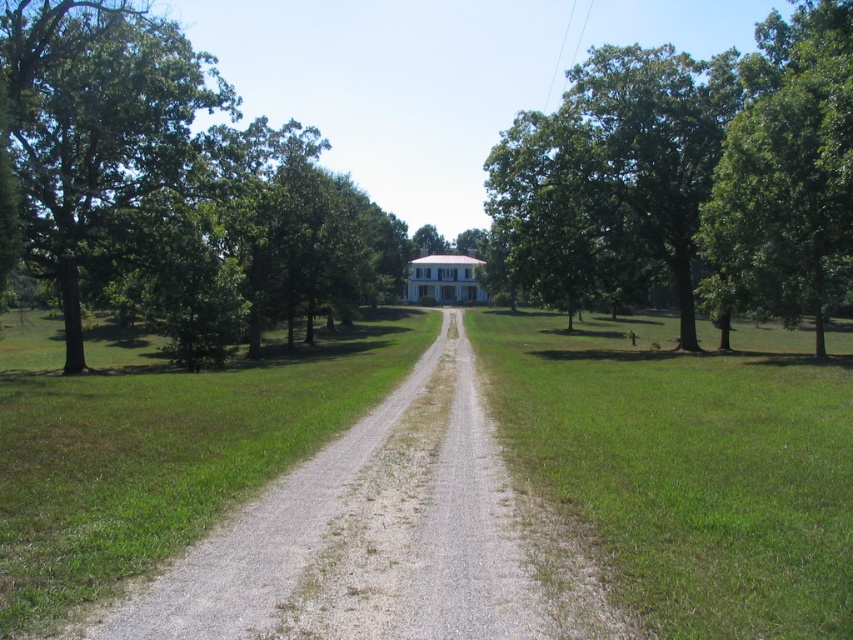
Question: From the image, what is the correct spatial relationship of green leafy tree at upper left in relation to green leafy tree at right?

Choices:
 (A) below
 (B) above

Answer: (B)

Question: Which point is farther from the camera taking this photo?

Choices:
 (A) (128, 163)
 (B) (759, 248)
 (C) (788, 93)

Answer: (A)

Question: Which object appears closest to the camera in this image?

Choices:
 (A) gray gravel road at center
 (B) green leafy tree at upper center

Answer: (A)

Question: Is green leafy tree at upper center wider than green leafy tree at right?

Choices:
 (A) no
 (B) yes

Answer: (B)

Question: Which of the following is the closest to the observer?

Choices:
 (A) green leafy tree at upper center
 (B) gray gravel road at center

Answer: (B)

Question: Is green leafy tree at upper left further to the viewer compared to green leafy tree at upper center?

Choices:
 (A) yes
 (B) no

Answer: (A)